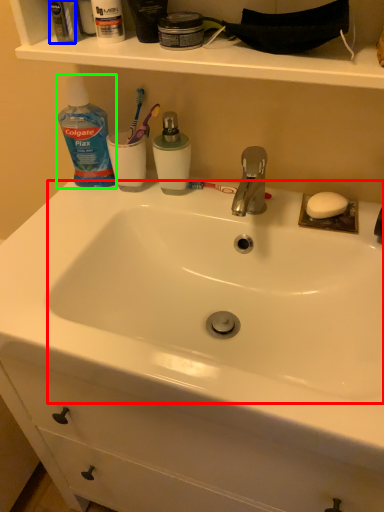
Question: Based on their relative distances, which object is farther from sink (highlighted by a red box)? Choose from mouthwash (highlighted by a blue box) and cleaning product (highlighted by a green box).

Choices:
 (A) mouthwash
 (B) cleaning product

Answer: (A)